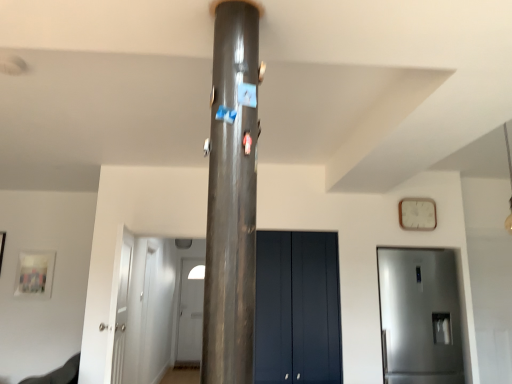
Question: From a real-world perspective, is satin silver refrigerator at right, which is the second door in front-to-back order, over shiny metallic pillar at center?

Choices:
 (A) yes
 (B) no

Answer: (B)

Question: Considering the relative sizes of satin silver refrigerator at right, which ranks as the first door in right-to-left order, and shiny metallic pillar at center in the image provided, is satin silver refrigerator at right, which ranks as the first door in right-to-left order, bigger than shiny metallic pillar at center?

Choices:
 (A) no
 (B) yes

Answer: (B)

Question: Is satin silver refrigerator at right, positioned as the 4th door in left-to-right order, positioned with its back to shiny metallic pillar at center?

Choices:
 (A) yes
 (B) no

Answer: (B)

Question: Would you say shiny metallic pillar at center is part of satin silver refrigerator at right, which is the second door in front-to-back order,'s contents?

Choices:
 (A) no
 (B) yes

Answer: (A)

Question: Is the surface of satin silver refrigerator at right, positioned as the 4th door in left-to-right order, in direct contact with shiny metallic pillar at center?

Choices:
 (A) yes
 (B) no

Answer: (B)

Question: Based on their sizes in the image, would you say white wooden clock at upper right is bigger or smaller than white glossy door at center, the fourth door when ordered from right to left?

Choices:
 (A) small
 (B) big

Answer: (A)

Question: Which is correct: white wooden clock at upper right is inside white glossy door at center, which is the 4th door in front-to-back order, or outside of it?

Choices:
 (A) outside
 (B) inside

Answer: (A)

Question: Looking at their shapes, would you say white wooden clock at upper right is wider or thinner than white glossy door at center, the 1th door viewed from the left?

Choices:
 (A) thin
 (B) wide

Answer: (A)

Question: Is white wooden clock at upper right in front of or behind white glossy door at center, which is counted as the first door, starting from the back, in the image?

Choices:
 (A) behind
 (B) front

Answer: (B)

Question: Does point (448, 347) appear closer or farther from the camera than point (425, 226)?

Choices:
 (A) closer
 (B) farther

Answer: (A)

Question: In terms of width, does satin silver refrigerator at right, which is the second door in front-to-back order, look wider or thinner when compared to white wooden clock at upper right?

Choices:
 (A) thin
 (B) wide

Answer: (B)

Question: Is satin silver refrigerator at right, positioned as the 4th door in left-to-right order, in front of or behind white wooden clock at upper right in the image?

Choices:
 (A) front
 (B) behind

Answer: (A)

Question: From the image's perspective, is satin silver refrigerator at right, which ranks as the first door in right-to-left order, positioned above or below white wooden clock at upper right?

Choices:
 (A) above
 (B) below

Answer: (B)

Question: Looking at the image, does white glossy door at center, the fourth door when ordered from right to left, seem bigger or smaller compared to white wooden clock at upper right?

Choices:
 (A) small
 (B) big

Answer: (B)

Question: Is point (194, 360) closer or farther from the camera than point (416, 225)?

Choices:
 (A) farther
 (B) closer

Answer: (A)